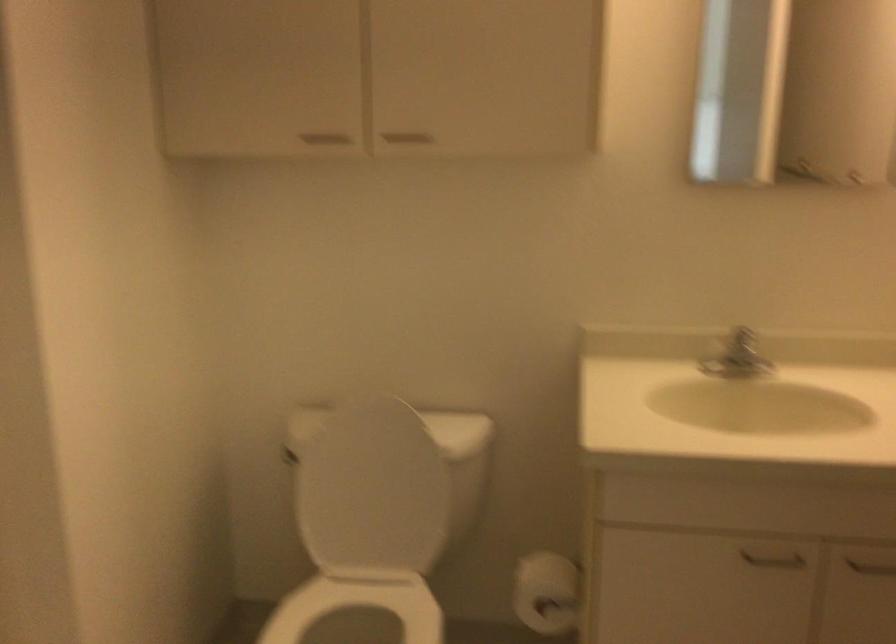
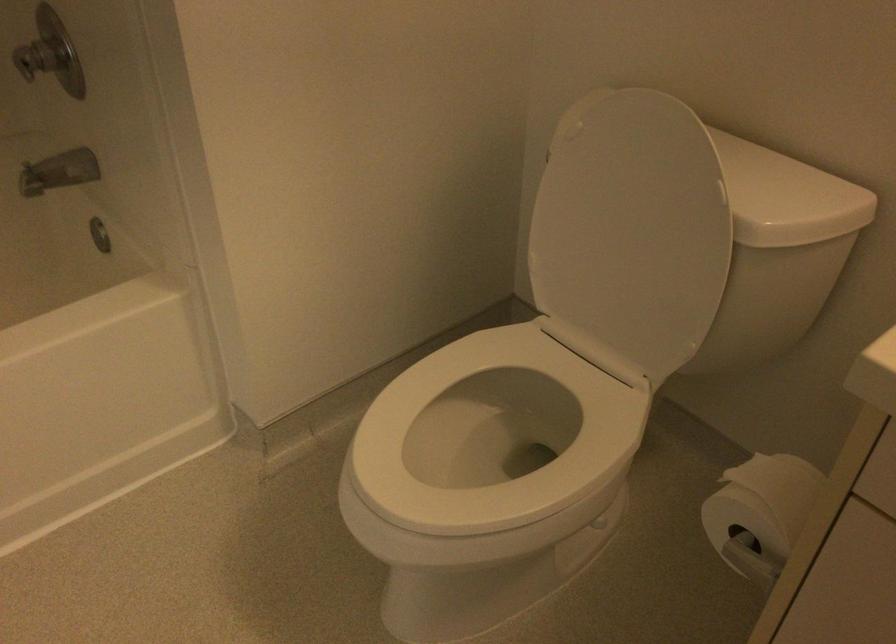
In the second image, find the point that corresponds to (375,483) in the first image.

(631, 232)